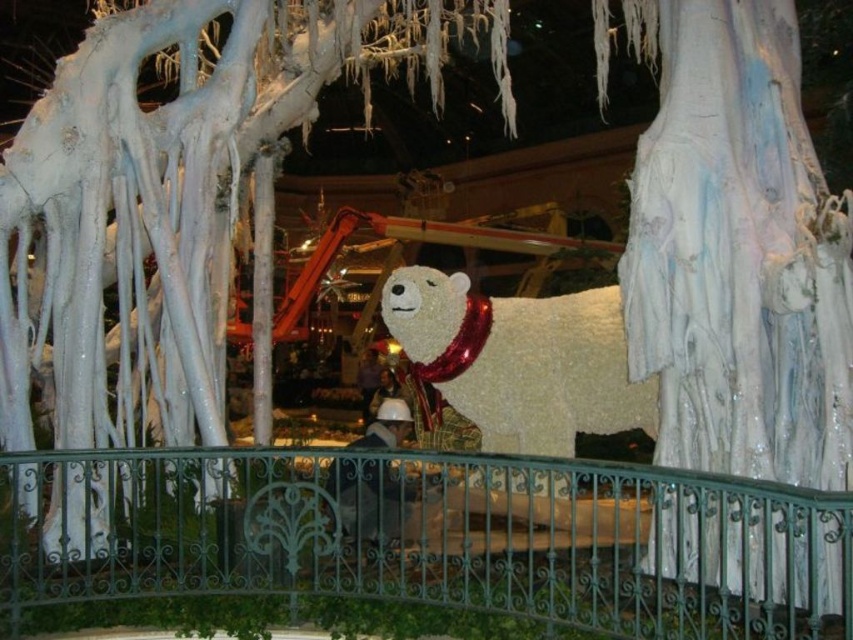
Question: Which point is farther to the camera?

Choices:
 (A) (440, 300)
 (B) (445, 540)

Answer: (A)

Question: Considering the relative positions of green wrought iron railing at center and white fluffy polar bear at center in the image provided, where is green wrought iron railing at center located with respect to white fluffy polar bear at center?

Choices:
 (A) right
 (B) left

Answer: (B)

Question: Which object is closer to the camera taking this photo?

Choices:
 (A) green wrought iron railing at center
 (B) white fluffy polar bear at center

Answer: (A)

Question: From the image, what is the correct spatial relationship of green wrought iron railing at center in relation to white fluffy polar bear at center?

Choices:
 (A) below
 (B) above

Answer: (A)

Question: Where is green wrought iron railing at center located in relation to white fluffy polar bear at center in the image?

Choices:
 (A) left
 (B) right

Answer: (A)